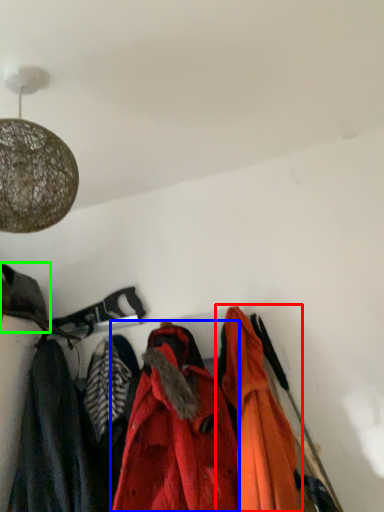
Question: Which is farther away from jacket (highlighted by a red box)? jacket (highlighted by a blue box) or cloak (highlighted by a green box)?

Choices:
 (A) jacket
 (B) cloak

Answer: (B)